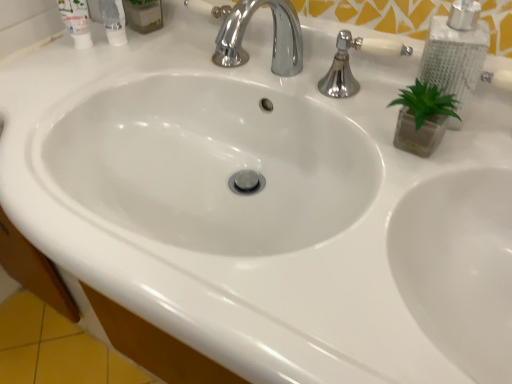
What do you see at coordinates (456, 51) in the screenshot?
I see `silver metallic soap dispenser at upper right` at bounding box center [456, 51].

Image resolution: width=512 pixels, height=384 pixels. Describe the element at coordinates (77, 21) in the screenshot. I see `white glossy tube at upper left, which appears as the 2th mouthwash when viewed from the right` at that location.

At what (x,y) coordinates should I click in order to perform the action: click on polished chrome faucet at upper center. Please return your answer as a coordinate pair (x, y). The width and height of the screenshot is (512, 384). Looking at the image, I should click on (349, 65).

Where is `silver metallic soap dispenser at upper right`? Image resolution: width=512 pixels, height=384 pixels. silver metallic soap dispenser at upper right is located at coordinates (456, 51).

At what (x,y) coordinates should I click in order to perform the action: click on plumbing fixture on the right side of white plastic mouthwash at upper left, the first mouthwash viewed from the right. Please return your answer as a coordinate pair (x, y). The image size is (512, 384). Looking at the image, I should click on (349, 65).

Considering the sizes of polished chrome faucet at upper center and white plastic mouthwash at upper left, the second mouthwash positioned from the left, in the image, is polished chrome faucet at upper center taller or shorter than white plastic mouthwash at upper left, the second mouthwash positioned from the left,?

In the image, polished chrome faucet at upper center appears to be shorter than white plastic mouthwash at upper left, the second mouthwash positioned from the left.

Based on the photo, is white plastic mouthwash at upper left, the first mouthwash viewed from the right, surrounded by polished chrome faucet at upper center?

No.

The image size is (512, 384). I want to click on soap dispenser on the right of white glossy tube at upper left, the 1th mouthwash from the left, so click(456, 51).

Considering the positions of objects silver metallic soap dispenser at upper right and white glossy tube at upper left, the 1th mouthwash from the left, in the image provided, who is in front, silver metallic soap dispenser at upper right or white glossy tube at upper left, the 1th mouthwash from the left,?

silver metallic soap dispenser at upper right is in front.

Are silver metallic soap dispenser at upper right and white glossy tube at upper left, which appears as the 2th mouthwash when viewed from the right, beside each other?

No, silver metallic soap dispenser at upper right is not with white glossy tube at upper left, which appears as the 2th mouthwash when viewed from the right.

Based on the photo, is white glossy tube at upper left, which appears as the 2th mouthwash when viewed from the right, to the right of white plastic mouthwash at upper left, the second mouthwash positioned from the left, from the viewer's perspective?

Incorrect, white glossy tube at upper left, which appears as the 2th mouthwash when viewed from the right, is not on the right side of white plastic mouthwash at upper left, the second mouthwash positioned from the left.

Does point (75, 10) come in front of point (111, 37)?

Yes, it is.

From a real-world perspective, which object rests below the other?

white glossy tube at upper left, which appears as the 2th mouthwash when viewed from the right, from a real-world perspective.

Which is in front, white glossy tube at upper left, the 1th mouthwash from the left, or white plastic mouthwash at upper left, the first mouthwash viewed from the right?

Positioned in front is white glossy tube at upper left, the 1th mouthwash from the left.

Does point (82, 25) appear closer or farther from the camera than point (352, 39)?

Point (82, 25) is farther from the camera than point (352, 39).

Does white glossy tube at upper left, which appears as the 2th mouthwash when viewed from the right, have a smaller size compared to polished chrome faucet at upper center?

Correct, white glossy tube at upper left, which appears as the 2th mouthwash when viewed from the right, occupies less space than polished chrome faucet at upper center.

Is white glossy tube at upper left, which appears as the 2th mouthwash when viewed from the right, positioned with its back to polished chrome faucet at upper center?

white glossy tube at upper left, which appears as the 2th mouthwash when viewed from the right, is not turned away from polished chrome faucet at upper center.

From the polished chrome faucet at upper center, count the 2nd mouthwash to the left and point to it. Please provide its 2D coordinates.

[(77, 21)]

Which is correct: polished chrome faucet at upper center is inside white glossy tube at upper left, the 1th mouthwash from the left, or outside of it?

polished chrome faucet at upper center is not inside white glossy tube at upper left, the 1th mouthwash from the left, it's outside.

Between polished chrome faucet at upper center and white glossy tube at upper left, which appears as the 2th mouthwash when viewed from the right, which one appears on the right side from the viewer's perspective?

From the viewer's perspective, polished chrome faucet at upper center appears more on the right side.

Can you confirm if polished chrome faucet at upper center is wider than white glossy tube at upper left, the 1th mouthwash from the left?

Yes.

Between polished chrome faucet at upper center and white glossy tube at upper left, the 1th mouthwash from the left, which one has larger size?

polished chrome faucet at upper center.

Is white plastic mouthwash at upper left, the first mouthwash viewed from the right, positioned with its back to chrome metallic faucet at upper center?

white plastic mouthwash at upper left, the first mouthwash viewed from the right, is not turned away from chrome metallic faucet at upper center.

Is white plastic mouthwash at upper left, the first mouthwash viewed from the right, inside the boundaries of chrome metallic faucet at upper center, or outside?

white plastic mouthwash at upper left, the first mouthwash viewed from the right, exists outside the volume of chrome metallic faucet at upper center.

How many degrees apart are the facing directions of white plastic mouthwash at upper left, the second mouthwash positioned from the left, and chrome metallic faucet at upper center?

The angular difference between white plastic mouthwash at upper left, the second mouthwash positioned from the left, and chrome metallic faucet at upper center is 0.000747 degrees.

Is white plastic mouthwash at upper left, the first mouthwash viewed from the right, closer to camera compared to chrome metallic faucet at upper center?

No, white plastic mouthwash at upper left, the first mouthwash viewed from the right, is behind chrome metallic faucet at upper center.

Considering the relative sizes of white glossy tube at upper left, which appears as the 2th mouthwash when viewed from the right, and chrome metallic faucet at upper center in the image provided, is white glossy tube at upper left, which appears as the 2th mouthwash when viewed from the right, smaller than chrome metallic faucet at upper center?

Yes.

Is there a large distance between white glossy tube at upper left, the 1th mouthwash from the left, and chrome metallic faucet at upper center?

Actually, white glossy tube at upper left, the 1th mouthwash from the left, and chrome metallic faucet at upper center are a little close together.

Which object is closer to the camera, white glossy tube at upper left, the 1th mouthwash from the left, or chrome metallic faucet at upper center?

chrome metallic faucet at upper center is in front.

Locate an element on the screen. Image resolution: width=512 pixels, height=384 pixels. plumbing fixture below the white plastic mouthwash at upper left, the second mouthwash positioned from the left (from a real-world perspective) is located at coordinates (349, 65).

Where is `soap dispenser in front of the white glossy tube at upper left, the 1th mouthwash from the left`? The image size is (512, 384). soap dispenser in front of the white glossy tube at upper left, the 1th mouthwash from the left is located at coordinates (456, 51).

Considering their positions, is polished chrome faucet at upper center positioned further to chrome metallic faucet at upper center than silver metallic soap dispenser at upper right?

silver metallic soap dispenser at upper right is positioned further to the anchor chrome metallic faucet at upper center.

From the image, which object appears to be farther from silver metallic soap dispenser at upper right, chrome metallic faucet at upper center or white plastic mouthwash at upper left, the first mouthwash viewed from the right?

white plastic mouthwash at upper left, the first mouthwash viewed from the right.

Looking at the image, which one is located closer to white glossy tube at upper left, the 1th mouthwash from the left, polished chrome faucet at upper center or white plastic mouthwash at upper left, the first mouthwash viewed from the right?

The object closer to white glossy tube at upper left, the 1th mouthwash from the left, is white plastic mouthwash at upper left, the first mouthwash viewed from the right.

When comparing their distances from silver metallic soap dispenser at upper right, does polished chrome faucet at upper center or chrome metallic faucet at upper center seem closer?

A: polished chrome faucet at upper center is closer to silver metallic soap dispenser at upper right.

From the image, which object appears to be nearer to white plastic mouthwash at upper left, the second mouthwash positioned from the left, polished chrome faucet at upper center or chrome metallic faucet at upper center?

The object closer to white plastic mouthwash at upper left, the second mouthwash positioned from the left, is chrome metallic faucet at upper center.

Which object lies nearer to the anchor point chrome metallic faucet at upper center, polished chrome faucet at upper center or white plastic mouthwash at upper left, the first mouthwash viewed from the right?

Among the two, polished chrome faucet at upper center is located nearer to chrome metallic faucet at upper center.

Based on their spatial positions, is white glossy tube at upper left, the 1th mouthwash from the left, or polished chrome faucet at upper center further from silver metallic soap dispenser at upper right?

Based on the image, white glossy tube at upper left, the 1th mouthwash from the left, appears to be further to silver metallic soap dispenser at upper right.

Estimate the real-world distances between objects in this image. Which object is closer to polished chrome faucet at upper center, silver metallic soap dispenser at upper right or white plastic mouthwash at upper left, the first mouthwash viewed from the right?

The object closer to polished chrome faucet at upper center is silver metallic soap dispenser at upper right.

The image size is (512, 384). In order to click on plumbing fixture between chrome metallic faucet at upper center and silver metallic soap dispenser at upper right in this screenshot , I will do `click(349, 65)`.

Identify the location of mouthwash between white glossy tube at upper left, which appears as the 2th mouthwash when viewed from the right, and polished chrome faucet at upper center, in the horizontal direction. (113, 21).

Locate an element on the screen. tap between white plastic mouthwash at upper left, the first mouthwash viewed from the right, and polished chrome faucet at upper center, in the horizontal direction is located at coordinates pos(273,36).

This screenshot has height=384, width=512. Identify the location of tap situated between white glossy tube at upper left, which appears as the 2th mouthwash when viewed from the right, and polished chrome faucet at upper center from left to right. (273, 36).